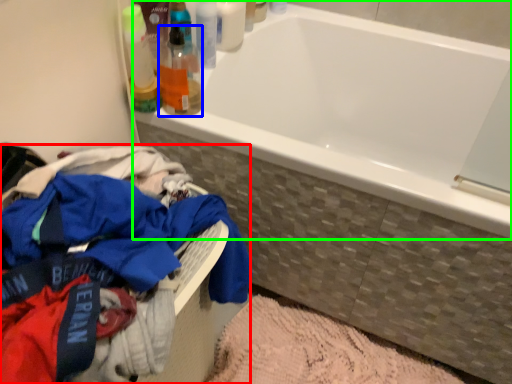
Question: Which object is the closest to the clothing (highlighted by a red box)? Choose among these: toiletry (highlighted by a blue box) or bathtub (highlighted by a green box).

Choices:
 (A) toiletry
 (B) bathtub

Answer: (A)